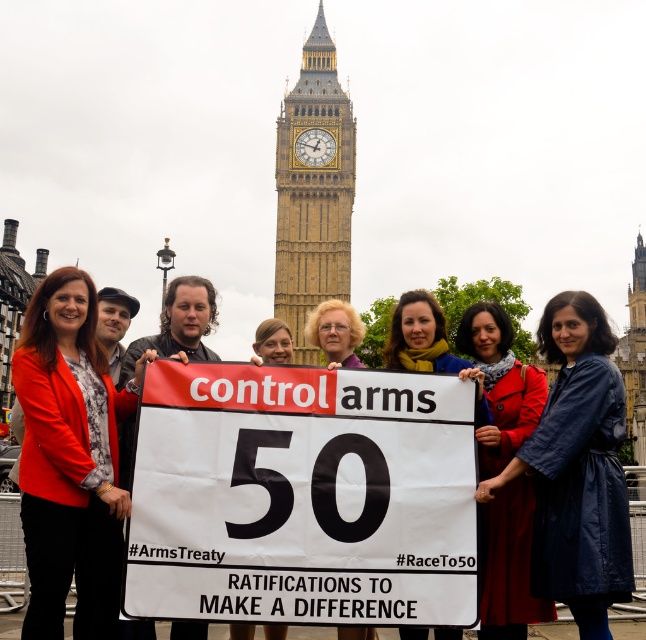
Question: Which point appears farthest from the camera in this image?

Choices:
 (A) (318, 81)
 (B) (599, 378)

Answer: (A)

Question: Where is white paper sign at center located in relation to blue fabric coat at center in the image?

Choices:
 (A) right
 (B) left

Answer: (B)

Question: Does white paper sign at center have a smaller size compared to gold/yellow metal big ben at upper center?

Choices:
 (A) yes
 (B) no

Answer: (A)

Question: Which object appears farthest from the camera in this image?

Choices:
 (A) blue fabric coat at center
 (B) white paper sign at center
 (C) gold/yellow metal big ben at upper center

Answer: (C)

Question: Is white paper sign at center above blue fabric coat at center?

Choices:
 (A) no
 (B) yes

Answer: (A)

Question: Based on their relative distances, which object is nearer to the blue fabric coat at center?

Choices:
 (A) white paper sign at center
 (B) gold/yellow metal big ben at upper center

Answer: (A)